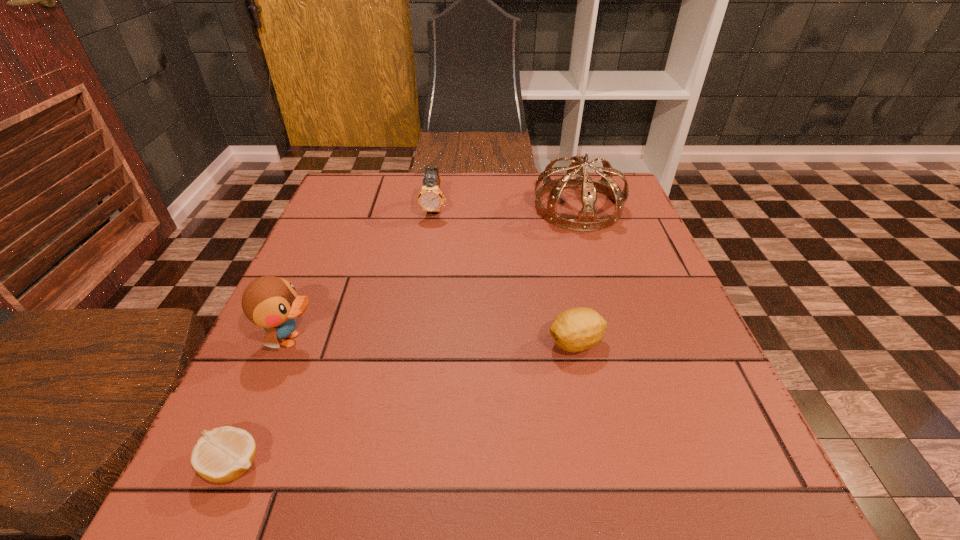
The height and width of the screenshot is (540, 960). I want to click on object present at the right edge, so pyautogui.click(x=586, y=221).

Identify the location of object that is at the near left corner. Image resolution: width=960 pixels, height=540 pixels. (222, 455).

Locate an element on the screen. object at the far right corner is located at coordinates (586, 221).

The height and width of the screenshot is (540, 960). In the image, there is a desktop. What are the coordinates of `vacant space at the far edge` in the screenshot? It's located at (469, 188).

Locate an element on the screen. This screenshot has width=960, height=540. vacant space at the near edge is located at coordinates (358, 521).

The height and width of the screenshot is (540, 960). In order to click on vacant space at the left edge in this screenshot , I will do `click(285, 401)`.

I want to click on free region at the right edge, so click(x=597, y=235).

At what (x,y) coordinates should I click in order to perform the action: click on free location at the far left corner. Please return your answer as a coordinate pair (x, y). The image size is (960, 540). Looking at the image, I should click on (394, 191).

Find the location of `vacant area at the far right corner`. vacant area at the far right corner is located at coordinates (636, 206).

At what (x,y) coordinates should I click in order to perform the action: click on free space between the taller lemon and the tiara. Please return your answer as a coordinate pair (x, y). This screenshot has height=540, width=960. Looking at the image, I should click on (577, 275).